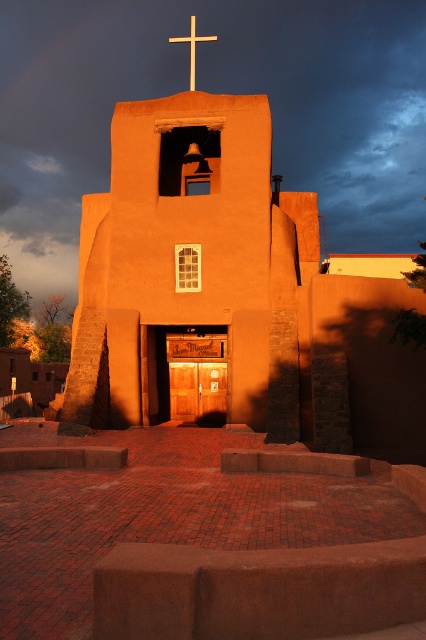
Question: Can you confirm if adobe stucco chapel at center is positioned above wooden cross at upper center?

Choices:
 (A) yes
 (B) no

Answer: (B)

Question: Which of the following is the closest to the observer?

Choices:
 (A) wooden cross at upper center
 (B) adobe stucco chapel at center

Answer: (B)

Question: Does adobe stucco chapel at center appear under wooden cross at upper center?

Choices:
 (A) no
 (B) yes

Answer: (B)

Question: In this image, where is adobe stucco chapel at center located relative to wooden cross at upper center?

Choices:
 (A) right
 (B) left

Answer: (A)